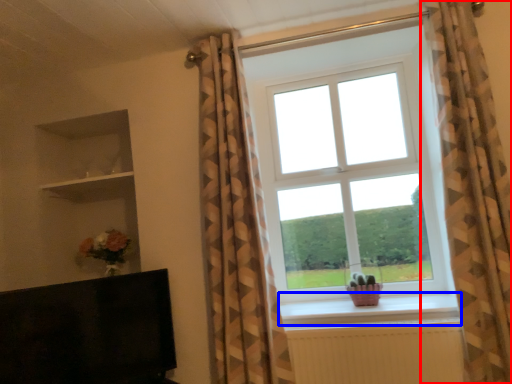
Question: Which of the following is the closest to the observer, curtain (highlighted by a red box) or window sill (highlighted by a blue box)?

Choices:
 (A) curtain
 (B) window sill

Answer: (A)